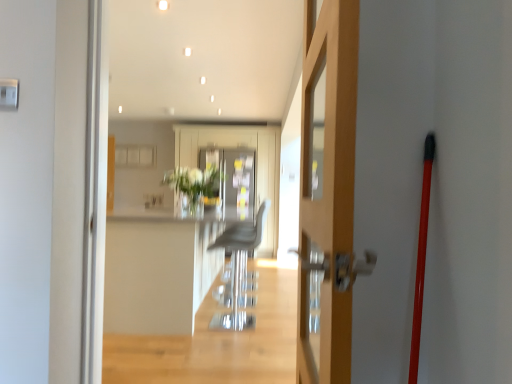
Question: Is point (224, 233) positioned closer to the camera than point (183, 178)?

Choices:
 (A) closer
 (B) farther

Answer: (B)

Question: Considering the positions of metallic gray armchair at center and translucent glass vase at center in the image, is metallic gray armchair at center wider or thinner than translucent glass vase at center?

Choices:
 (A) thin
 (B) wide

Answer: (A)

Question: Based on their relative distances, which object is nearer to the wooden door at center?

Choices:
 (A) white glossy counter top at center
 (B) translucent glass vase at center
 (C) metallic gray armchair at center

Answer: (A)

Question: Which of these objects is positioned closest to the white glossy counter top at center?

Choices:
 (A) metallic gray armchair at center
 (B) wooden door at center
 (C) translucent glass vase at center

Answer: (A)